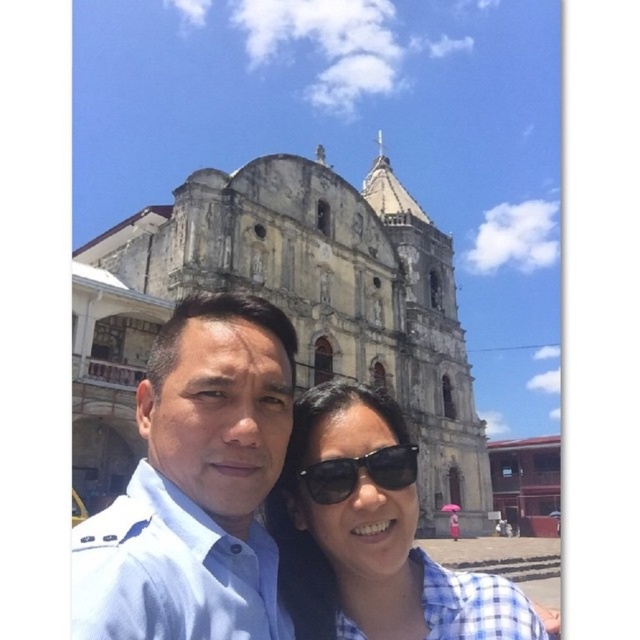
Question: Observing the image, what is the correct spatial positioning of stone church at center in reference to matte blue shirt at center?

Choices:
 (A) below
 (B) above

Answer: (B)

Question: Which of the following is the farthest from the observer?

Choices:
 (A) matte blue shirt at center
 (B) stone church at center
 (C) black plastic sunglasses at center

Answer: (B)

Question: Does matte blue shirt at center appear on the right side of black plastic sunglasses at center?

Choices:
 (A) yes
 (B) no

Answer: (B)

Question: Is stone church at center wider than black plastic sunglasses at center?

Choices:
 (A) yes
 (B) no

Answer: (A)

Question: Which is nearer to the matte blue shirt at center?

Choices:
 (A) stone church at center
 (B) black plastic sunglasses at center
 (C) checkered fabric shirt at center
 (D) blue uniform shirt at center

Answer: (D)

Question: Which object is positioned farthest from the blue uniform shirt at center?

Choices:
 (A) stone church at center
 (B) black plastic sunglasses at center
 (C) checkered fabric shirt at center

Answer: (A)